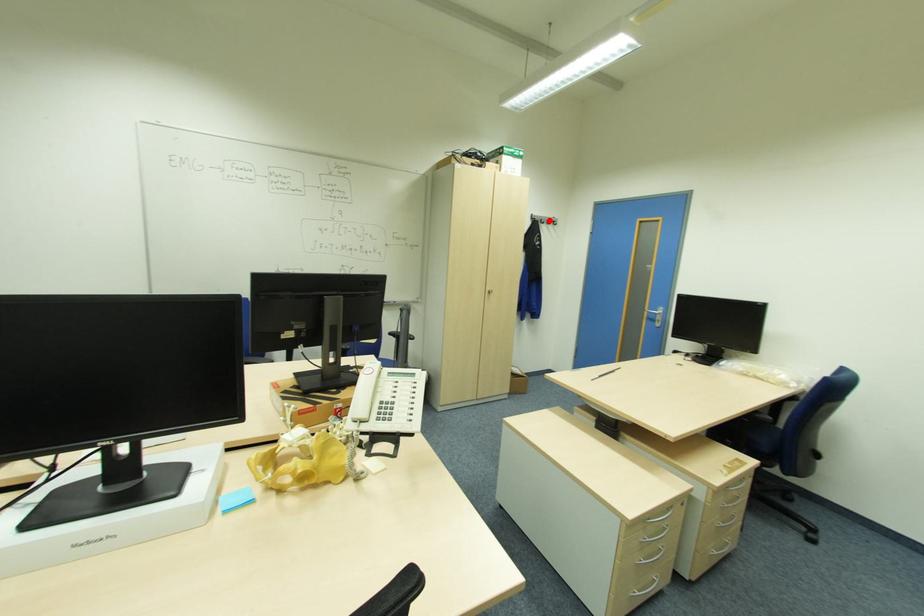
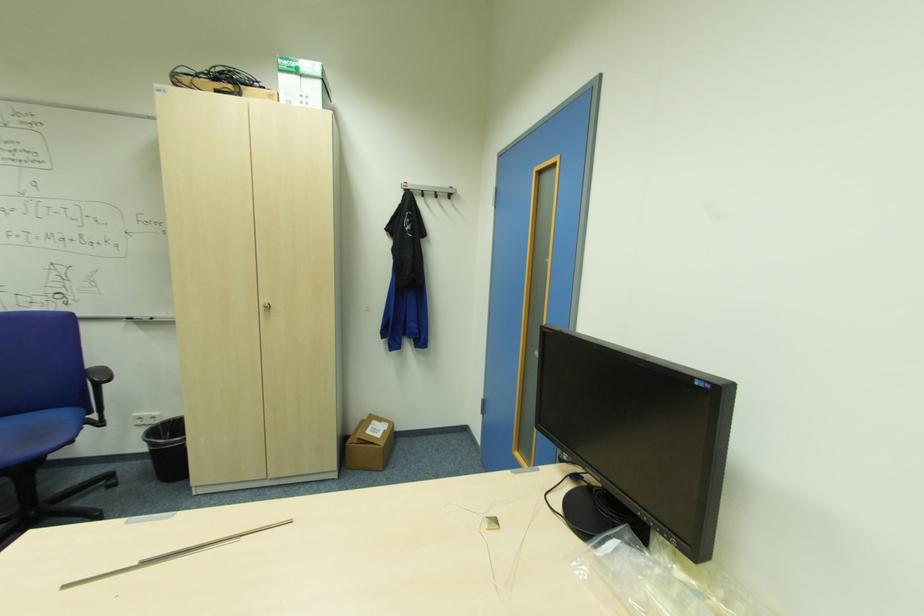
Where in the second image is the point corresponding to the highlighted location from the first image?

(439, 192)